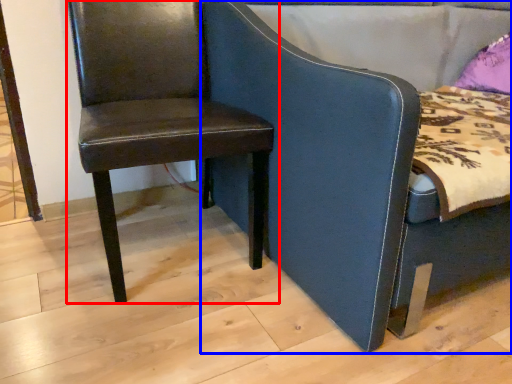
Question: Among these objects, which one is farthest to the camera, chair (highlighted by a red box) or chair (highlighted by a blue box)?

Choices:
 (A) chair
 (B) chair

Answer: (A)